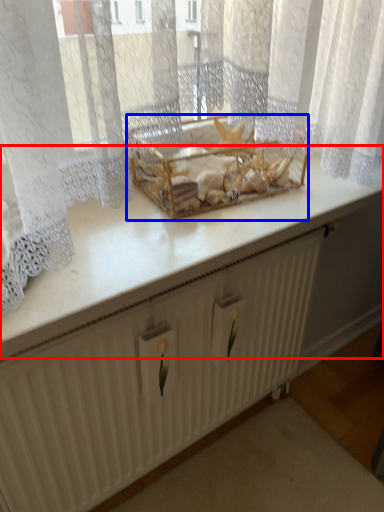
Question: Among these objects, which one is nearest to the camera, counter top (highlighted by a red box) or crate (highlighted by a blue box)?

Choices:
 (A) counter top
 (B) crate

Answer: (A)